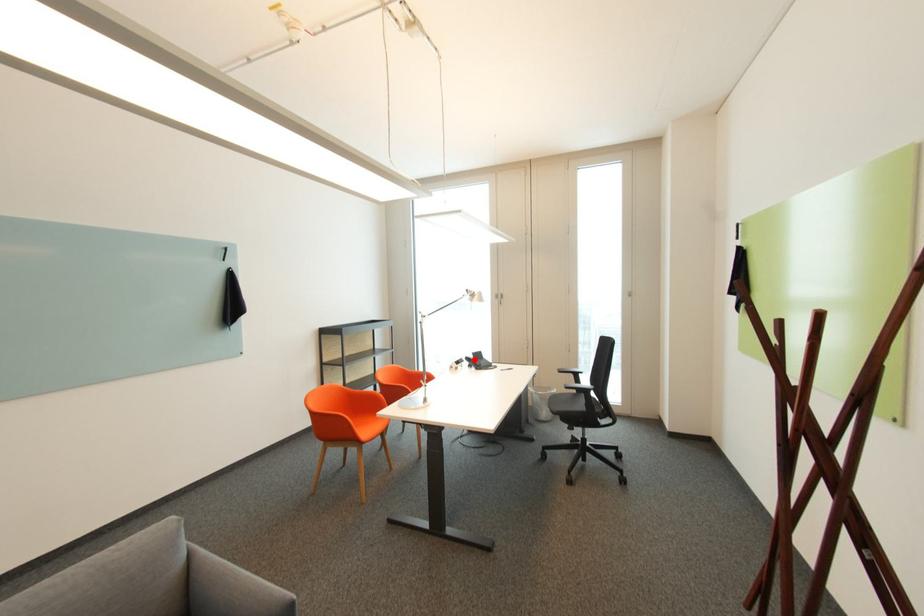
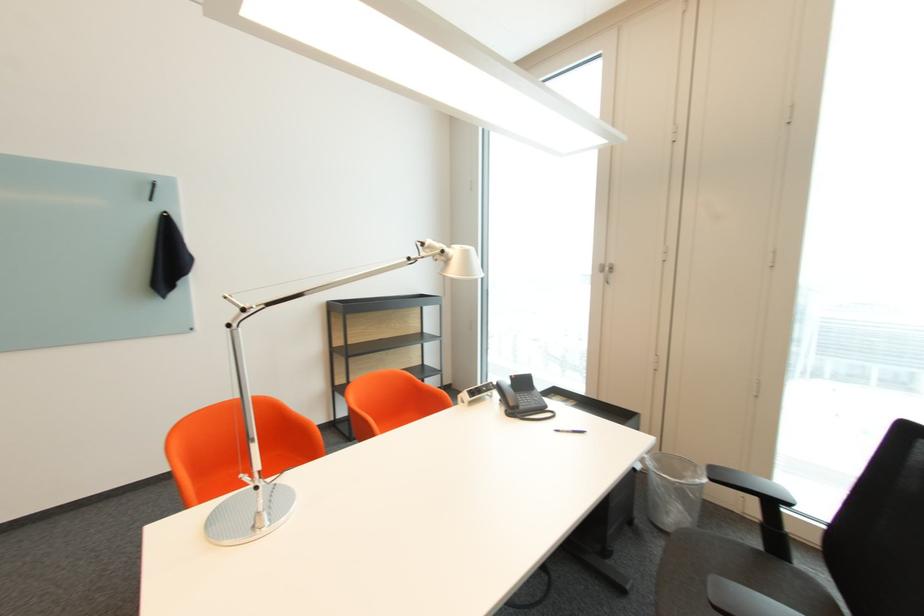
The point at the highlighted location is marked in the first image. Where is the corresponding point in the second image?

(505, 387)